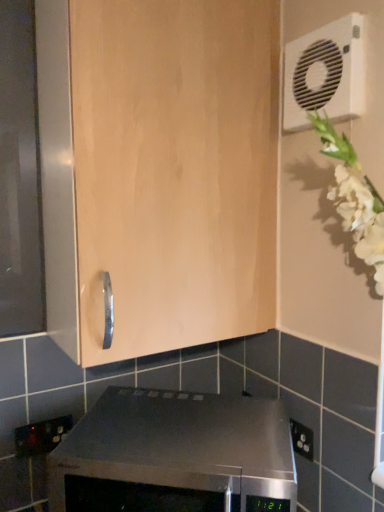
Question: Does black plastic electric outlet at lower left turn towards white plastic air conditioning unit at upper right?

Choices:
 (A) no
 (B) yes

Answer: (A)

Question: Does black plastic electric outlet at lower left have a larger size compared to white plastic air conditioning unit at upper right?

Choices:
 (A) yes
 (B) no

Answer: (B)

Question: Is black plastic electric outlet at lower left to the right of white plastic air conditioning unit at upper right from the viewer's perspective?

Choices:
 (A) no
 (B) yes

Answer: (A)

Question: Is black plastic electric outlet at lower left next to white plastic air conditioning unit at upper right and touching it?

Choices:
 (A) yes
 (B) no

Answer: (B)

Question: From a real-world perspective, does black plastic electric outlet at lower left stand above white plastic air conditioning unit at upper right?

Choices:
 (A) no
 (B) yes

Answer: (A)

Question: Relative to light wood cabinet at center, is white plastic air conditioning unit at upper right in front or behind?

Choices:
 (A) behind
 (B) front

Answer: (A)

Question: In terms of size, does white plastic air conditioning unit at upper right appear bigger or smaller than light wood cabinet at center?

Choices:
 (A) small
 (B) big

Answer: (A)

Question: From the image's perspective, is white plastic air conditioning unit at upper right located above or below light wood cabinet at center?

Choices:
 (A) below
 (B) above

Answer: (B)

Question: In the image, is white plastic air conditioning unit at upper right on the left side or the right side of light wood cabinet at center?

Choices:
 (A) left
 (B) right

Answer: (B)

Question: Based on their positions, is satin black oven at lower center located to the left or right of white plastic air conditioning unit at upper right?

Choices:
 (A) right
 (B) left

Answer: (B)

Question: Which is correct: satin black oven at lower center is inside white plastic air conditioning unit at upper right, or outside of it?

Choices:
 (A) outside
 (B) inside

Answer: (A)

Question: From the image's perspective, is satin black oven at lower center above or below white plastic air conditioning unit at upper right?

Choices:
 (A) above
 (B) below

Answer: (B)

Question: Considering their positions, is satin black oven at lower center located in front of or behind white plastic air conditioning unit at upper right?

Choices:
 (A) behind
 (B) front

Answer: (B)

Question: Is satin black oven at lower center in front of or behind light wood cabinet at center in the image?

Choices:
 (A) behind
 (B) front

Answer: (B)

Question: Based on their sizes in the image, would you say satin black oven at lower center is bigger or smaller than light wood cabinet at center?

Choices:
 (A) big
 (B) small

Answer: (B)